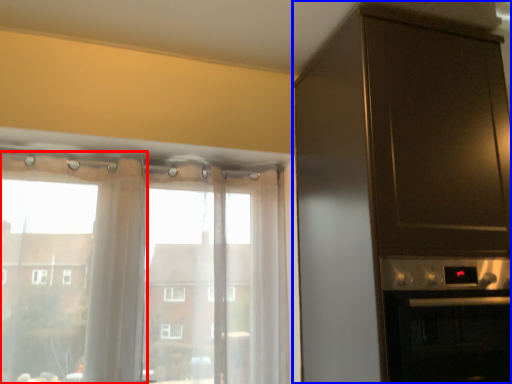
Question: Which of the following is the closest to the observer, curtain (highlighted by a red box) or cabinetry (highlighted by a blue box)?

Choices:
 (A) curtain
 (B) cabinetry

Answer: (B)